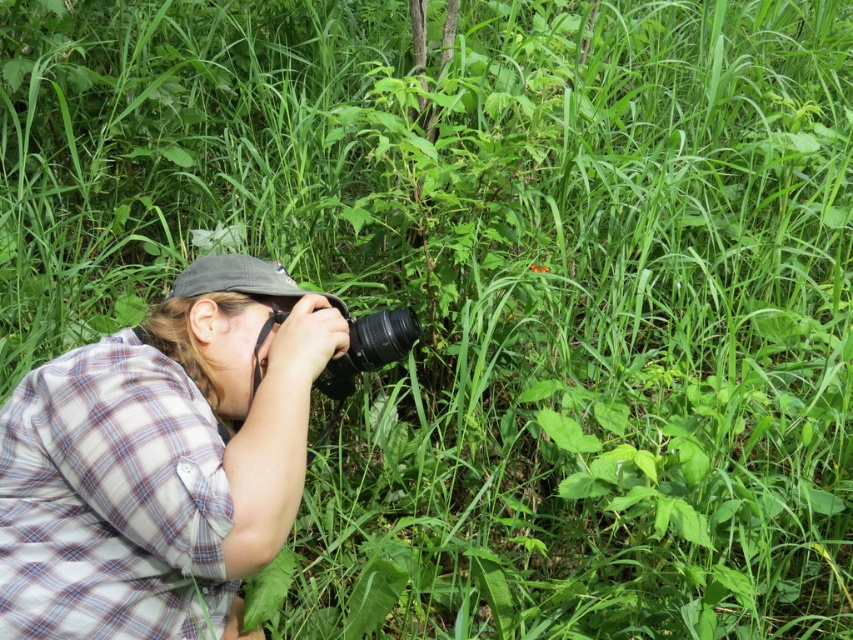
You are a photographer trying to capture the exact spot where the plaid fabric shirt at left is located at point (160, 460). Can you describe the position of the plaid fabric shirt at left relative to the camera lens?

The plaid fabric shirt at left is located at point (160, 460), which is to the left side of the camera lens.

You are a photographer trying to adjust your equipment. You have a plaid fabric shirt at left and a black plastic camera at center. Which item is located to the right of the other?

The black plastic camera at center is to the right of the plaid fabric shirt at left.